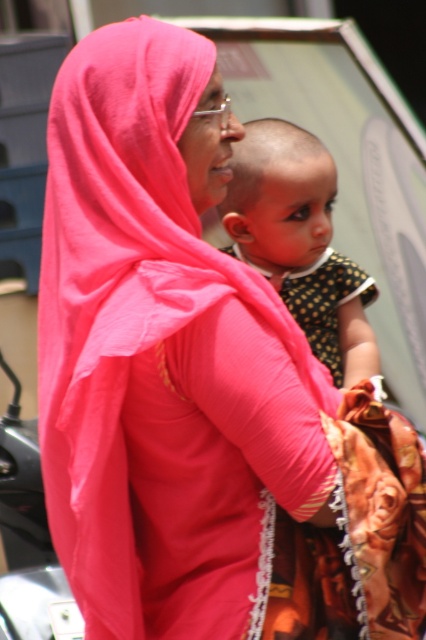
Question: Does matte pink scarf at center have a larger size compared to polka dot fabric baby at center?

Choices:
 (A) yes
 (B) no

Answer: (A)

Question: Is matte pink scarf at center thinner than polka dot fabric baby at center?

Choices:
 (A) yes
 (B) no

Answer: (B)

Question: Can you confirm if matte pink scarf at center is positioned to the right of polka dot fabric baby at center?

Choices:
 (A) no
 (B) yes

Answer: (A)

Question: Which of the following is the closest to the observer?

Choices:
 (A) matte pink scarf at center
 (B) polka dot fabric baby at center

Answer: (A)